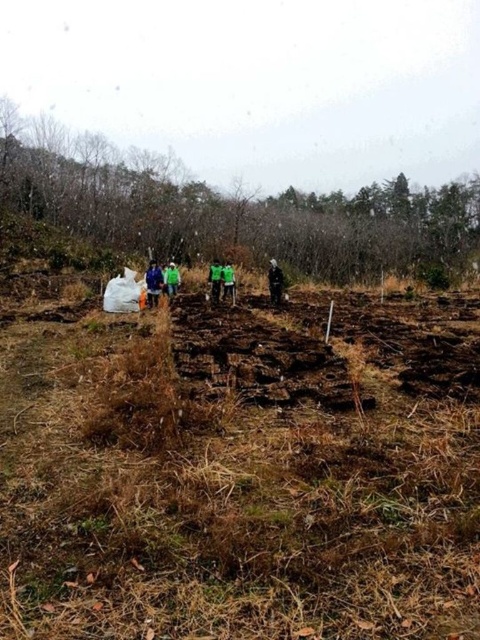
You are standing in a garden and see two points marked in the soil. The first point is at coordinates point (224, 285) and the second is at point (213, 298). Which point is closer to you?

Point (224, 285) is further to the camera than point (213, 298), so the point closer to you is point (213, 298).